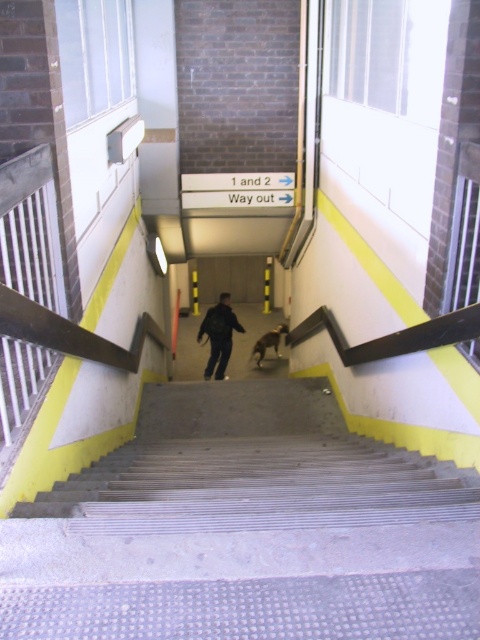
Is metallic gray stairs at center taller than black matte jacket at center?

No.

Does metallic gray stairs at center come in front of black matte jacket at center?

Yes, it is in front of black matte jacket at center.

I want to click on metallic gray stairs at center, so click(x=256, y=486).

You are a GUI agent. You are given a task and a screenshot of the screen. Output one action in this format:
    pyautogui.click(x=<x>, y=<y>)
    Task: Click on the metallic gray stairs at center
    
    Given the screenshot: What is the action you would take?
    pyautogui.click(x=256, y=486)

In the scene shown: Measure the distance between point (206, 376) and camera.

9.22 meters

I want to click on black matte jacket at center, so click(x=218, y=336).

You are a GUI agent. You are given a task and a screenshot of the screen. Output one action in this format:
    pyautogui.click(x=<x>, y=<y>)
    Task: Click on the black matte jacket at center
    
    Given the screenshot: What is the action you would take?
    pyautogui.click(x=218, y=336)

The image size is (480, 640). Find the location of `black matte jacket at center`. black matte jacket at center is located at coordinates (218, 336).

Is metallic gray stairs at center in front of brown fur dog at center?

Yes, it is in front of brown fur dog at center.

Identify the location of metallic gray stairs at center. (256, 486).